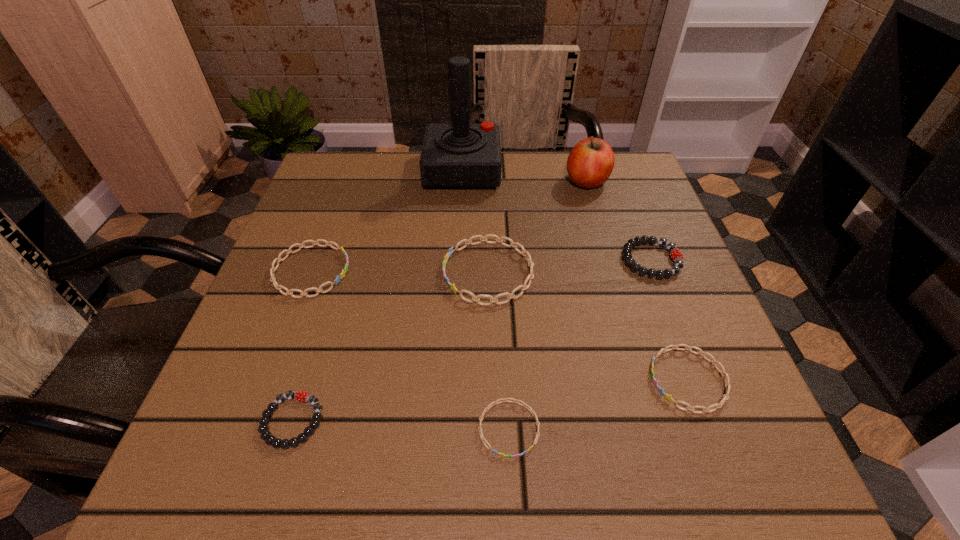
At what (x,y) coordinates should I click in order to perform the action: click on free space located 0.300m on the surface of the third biggest blue bracelet showing star-shaped elements. Please return your answer as a coordinate pair (x, y). The height and width of the screenshot is (540, 960). Looking at the image, I should click on (462, 380).

Identify the location of vacant space located on the surface of the third biggest blue bracelet showing star-shaped elements. The height and width of the screenshot is (540, 960). (538, 380).

Find the location of a particular element. vacant space located on the surface of the third biggest blue bracelet showing star-shaped elements is located at coordinates (468, 380).

Where is `vacant region located 0.050m on the back of the nearer black bracelet`? The image size is (960, 540). vacant region located 0.050m on the back of the nearer black bracelet is located at coordinates (310, 366).

Where is `joystick that is at the far edge`? The width and height of the screenshot is (960, 540). joystick that is at the far edge is located at coordinates (460, 155).

The height and width of the screenshot is (540, 960). In order to click on apple located in the far edge section of the desktop in this screenshot , I will do `click(591, 161)`.

Locate an element on the screen. The image size is (960, 540). apple located at the right edge is located at coordinates (591, 161).

Image resolution: width=960 pixels, height=540 pixels. I want to click on object positioned at the near left corner, so click(x=265, y=435).

Image resolution: width=960 pixels, height=540 pixels. Identify the location of object located at the far right corner. (591, 161).

In order to click on vacant space at the far edge in this screenshot , I will do `click(503, 180)`.